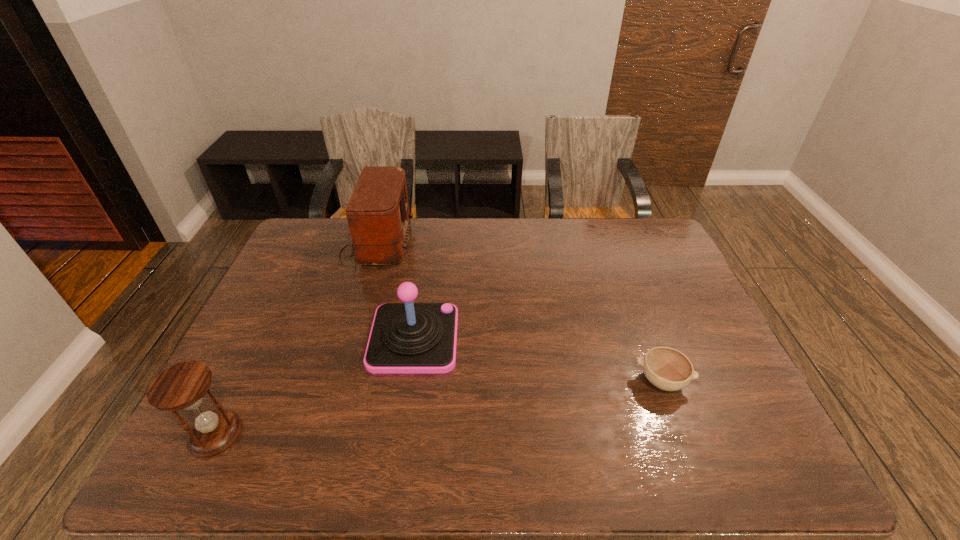
In order to click on object present at the far edge in this screenshot , I will do `click(378, 215)`.

The height and width of the screenshot is (540, 960). I want to click on object that is at the near edge, so click(182, 386).

Locate an element on the screen. The width and height of the screenshot is (960, 540). object that is at the left edge is located at coordinates (182, 386).

The image size is (960, 540). In order to click on object at the right edge in this screenshot , I will do `click(668, 369)`.

In order to click on object situated at the near left corner in this screenshot , I will do `click(182, 386)`.

I want to click on vacant space at the far edge of the desktop, so click(x=543, y=242).

In the image, there is a desktop. At what (x,y) coordinates should I click in order to perform the action: click on blank space at the near edge. Please return your answer as a coordinate pair (x, y). Looking at the image, I should click on (568, 478).

The image size is (960, 540). In the image, there is a desktop. Identify the location of vacant area at the left edge. (293, 282).

This screenshot has height=540, width=960. Identify the location of free region at the right edge of the desktop. [660, 303].

The height and width of the screenshot is (540, 960). What are the coordinates of `free location at the far left corner` in the screenshot? It's located at (322, 230).